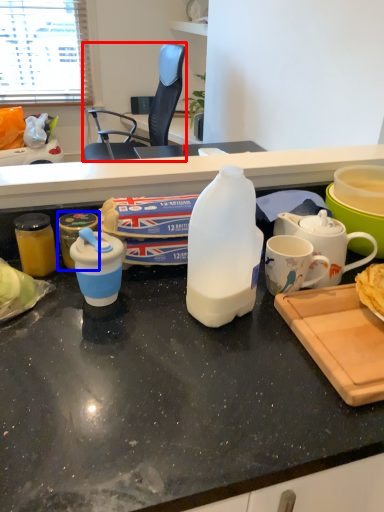
Question: Among these objects, which one is farthest to the camera, chair (highlighted by a red box) or kitchen appliance (highlighted by a blue box)?

Choices:
 (A) chair
 (B) kitchen appliance

Answer: (A)